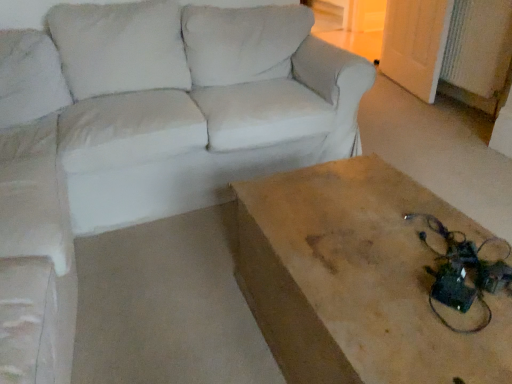
Question: Considering the relative sizes of wooden table at center and white fabric couch at upper left in the image provided, is wooden table at center thinner than white fabric couch at upper left?

Choices:
 (A) no
 (B) yes

Answer: (B)

Question: From the image's perspective, is wooden table at center over white fabric couch at upper left?

Choices:
 (A) yes
 (B) no

Answer: (B)

Question: From a real-world perspective, does wooden table at center sit lower than white fabric couch at upper left?

Choices:
 (A) yes
 (B) no

Answer: (B)

Question: Is wooden table at center facing towards white fabric couch at upper left?

Choices:
 (A) yes
 (B) no

Answer: (B)

Question: Considering the relative positions of wooden table at center and white fabric couch at upper left in the image provided, is wooden table at center in front of white fabric couch at upper left?

Choices:
 (A) yes
 (B) no

Answer: (A)

Question: Does wooden table at center have a greater height compared to white fabric couch at upper left?

Choices:
 (A) yes
 (B) no

Answer: (A)

Question: Does white fabric couch at upper left have a larger size compared to wooden table at center?

Choices:
 (A) no
 (B) yes

Answer: (B)

Question: Is white fabric couch at upper left closer to the viewer compared to wooden table at center?

Choices:
 (A) yes
 (B) no

Answer: (B)

Question: Can we say white fabric couch at upper left lies outside wooden table at center?

Choices:
 (A) yes
 (B) no

Answer: (A)

Question: Is white fabric couch at upper left to the right of wooden table at center from the viewer's perspective?

Choices:
 (A) yes
 (B) no

Answer: (B)

Question: Is white fabric couch at upper left thinner than wooden table at center?

Choices:
 (A) yes
 (B) no

Answer: (B)

Question: Would you say white fabric couch at upper left contains wooden table at center?

Choices:
 (A) yes
 (B) no

Answer: (B)

Question: Is wooden table at center taller or shorter than white fabric couch at upper left?

Choices:
 (A) short
 (B) tall

Answer: (B)